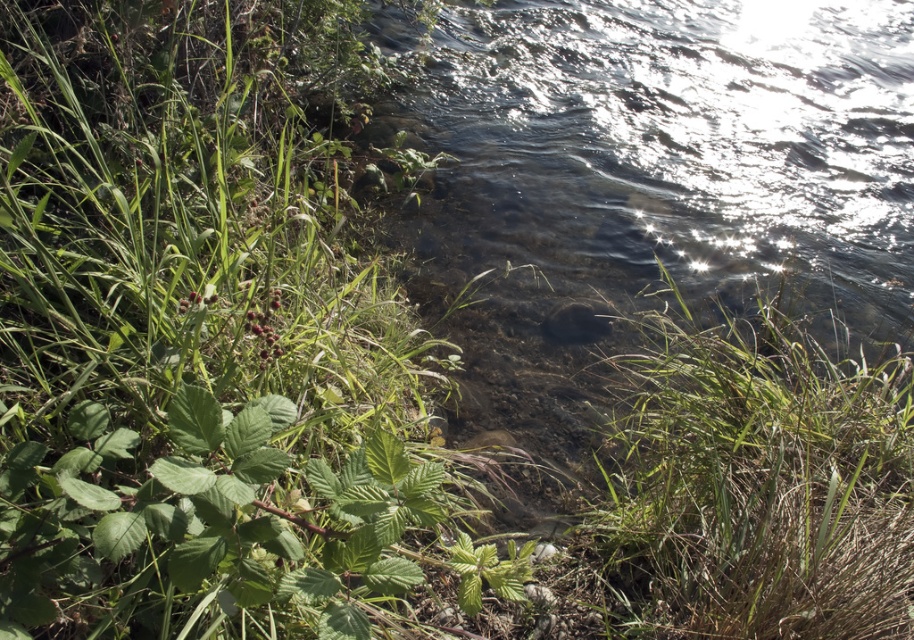
You are standing at the edge of the water and want to pick a leaf from the green leafy plant at left and a blade of green grass at lower right. Which one will you need to reach further to get?

The green grass at lower right is further away from the viewer than the green leafy plant at left, so you will need to reach further to get the green grass at lower right.

You are a small animal trying to cross from the green leafy plant at left to the green grass at lower right. Can you make the jump if your maximum jumping distance is 3 feet?

The distance between the green leafy plant at left and green grass at lower right is 3.78 feet, which is greater than your maximum jumping distance of 3 feet. Therefore, you cannot make the jump.

You are a gardener who wants to plant a new shrub in an area where it can grow to its full size. Based on the scene, which area would you choose between the green leafy plant at left and the green grass at lower right?

The green leafy plant at left is bigger than the green grass at lower right, so you should choose the area where the green leafy plant at left is located because it has more space to grow to its full size.